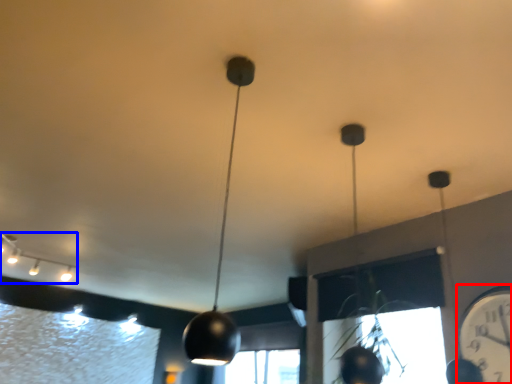
Question: Among these objects, which one is nearest to the camera, clock (highlighted by a red box) or lamp (highlighted by a blue box)?

Choices:
 (A) clock
 (B) lamp

Answer: (A)